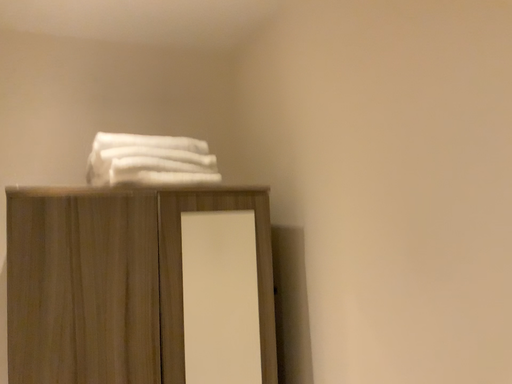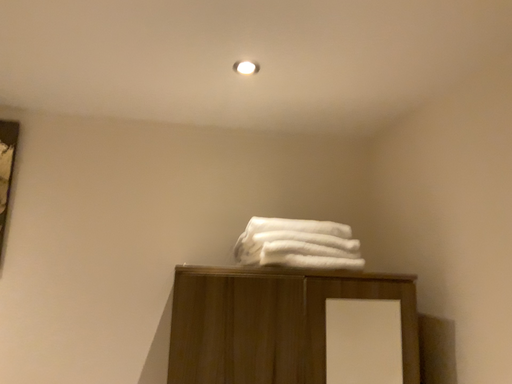
Question: Which way did the camera rotate in the video?

Choices:
 (A) rotated left
 (B) rotated right

Answer: (A)